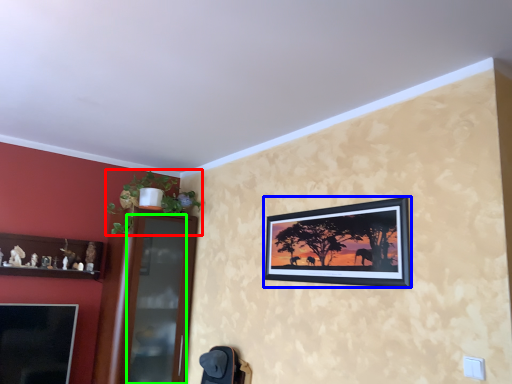
Question: Which object is positioned farthest from plant (highlighted by a red box)? Select from picture frame (highlighted by a blue box) and glass door (highlighted by a green box).

Choices:
 (A) picture frame
 (B) glass door

Answer: (A)